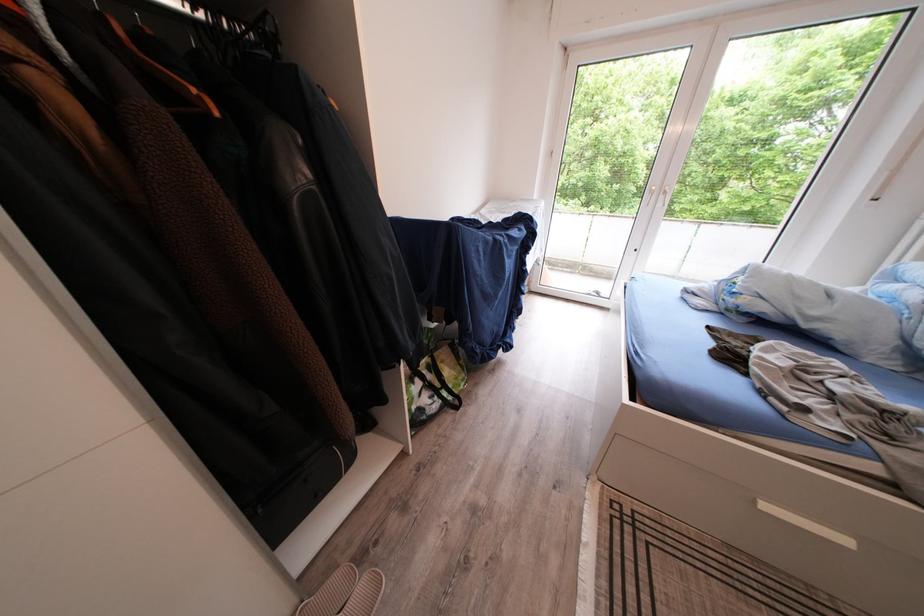
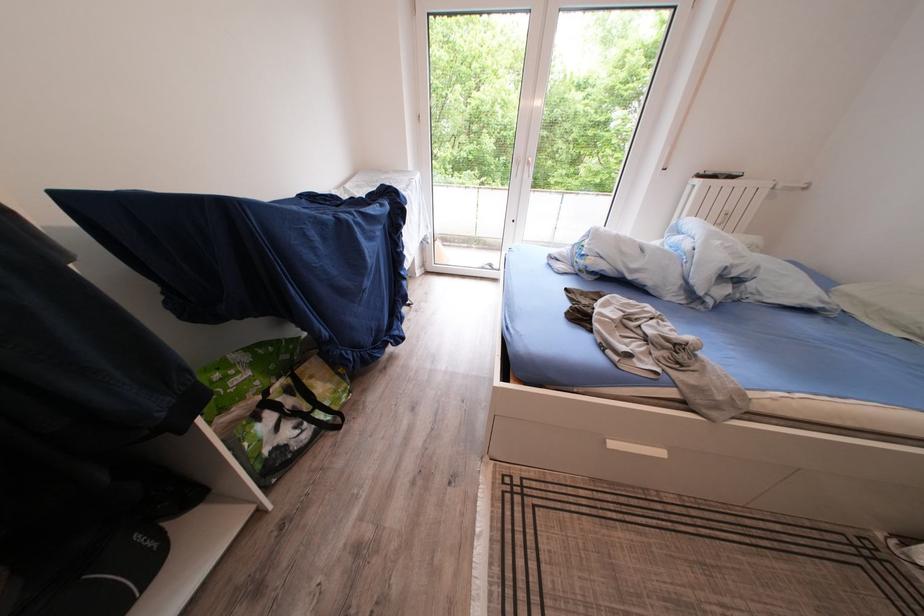
Where in the second image is the point corresponding to point 773,512 from the first image?

(621, 450)